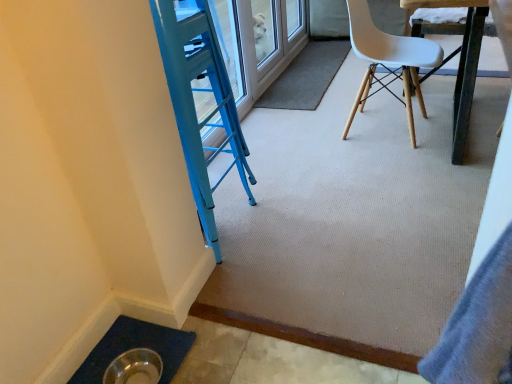
Question: Is metallic dark brown table at upper right at the back of carpet at center?

Choices:
 (A) yes
 (B) no

Answer: (B)

Question: Is carpet at center behind metallic dark brown table at upper right?

Choices:
 (A) yes
 (B) no

Answer: (A)

Question: Is carpet at center not near metallic dark brown table at upper right?

Choices:
 (A) no
 (B) yes

Answer: (A)

Question: Is carpet at center not inside metallic dark brown table at upper right?

Choices:
 (A) yes
 (B) no

Answer: (A)

Question: Is carpet at center placed right next to metallic dark brown table at upper right?

Choices:
 (A) yes
 (B) no

Answer: (B)

Question: Does carpet at center have a greater width compared to metallic dark brown table at upper right?

Choices:
 (A) yes
 (B) no

Answer: (B)

Question: From a real-world perspective, does white plastic chair at upper right sit lower than metallic dark brown table at upper right?

Choices:
 (A) no
 (B) yes

Answer: (B)

Question: From the image's perspective, does white plastic chair at upper right appear higher than metallic dark brown table at upper right?

Choices:
 (A) no
 (B) yes

Answer: (A)

Question: Does white plastic chair at upper right have a larger size compared to metallic dark brown table at upper right?

Choices:
 (A) yes
 (B) no

Answer: (B)

Question: Could you tell me if white plastic chair at upper right is turned towards metallic dark brown table at upper right?

Choices:
 (A) no
 (B) yes

Answer: (B)

Question: Is white plastic chair at upper right shorter than metallic dark brown table at upper right?

Choices:
 (A) no
 (B) yes

Answer: (B)

Question: Considering the relative positions of white plastic chair at upper right and metallic dark brown table at upper right in the image provided, is white plastic chair at upper right in front of metallic dark brown table at upper right?

Choices:
 (A) yes
 (B) no

Answer: (B)

Question: From a real-world perspective, is metallic dark brown table at upper right positioned under carpet at center based on gravity?

Choices:
 (A) yes
 (B) no

Answer: (B)